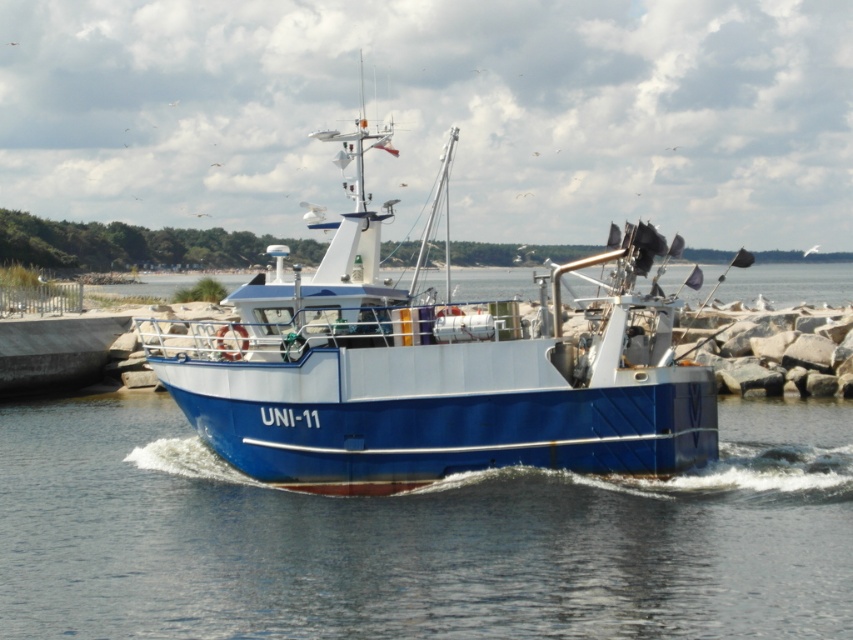
You are standing on the shore and see the blue smooth water at center and the blue matte boat at center. Which one is located to the right side from your perspective?

The blue smooth water at center is to the right of the blue matte boat at center, so the blue smooth water at center is located to the right side from your perspective.

Looking at this image, you are standing on the shore and looking at the blue smooth water at center and the blue matte boat at center. Which object is nearer to you?

The blue smooth water at center is closer to the viewer than the blue matte boat at center.